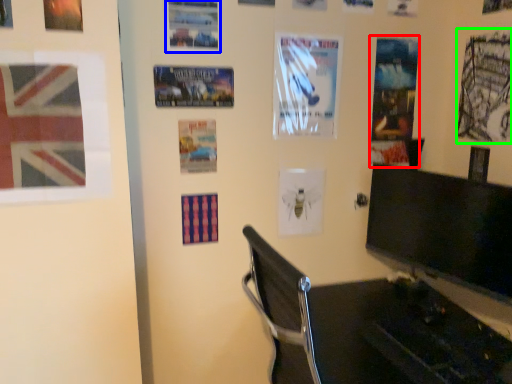
Question: Which object is positioned closest to poster page (highlighted by a red box)? Select from poster (highlighted by a blue box) and poster page (highlighted by a green box).

Choices:
 (A) poster
 (B) poster page

Answer: (B)